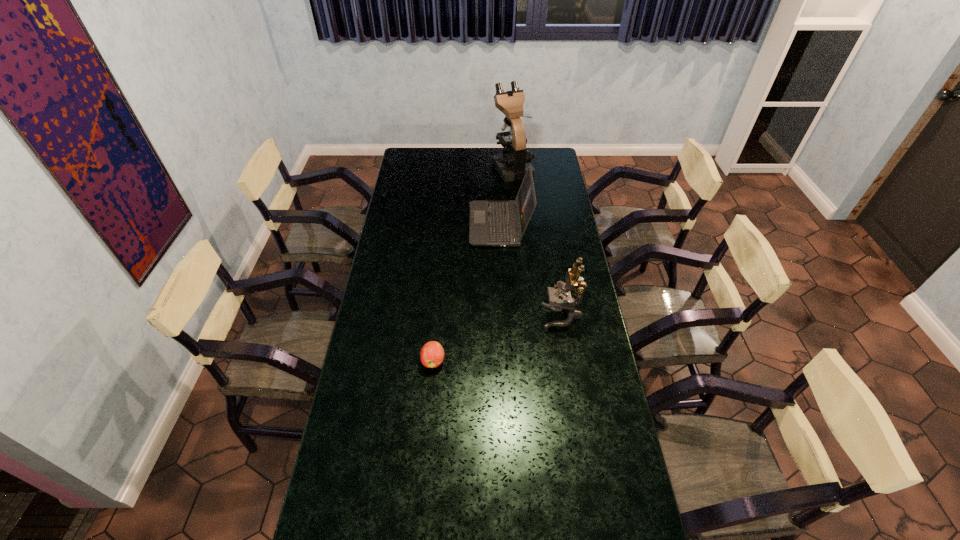
I want to click on empty space that is in between the third tallest object and the shorter microscope, so (531, 271).

The width and height of the screenshot is (960, 540). I want to click on free space between the third shortest object and the farther microscope, so click(x=538, y=241).

Where is `vacant space in between the laptop_computer and the tallest object`? vacant space in between the laptop_computer and the tallest object is located at coordinates (506, 195).

The height and width of the screenshot is (540, 960). Find the location of `vacant point located between the third farthest object and the third tallest object`. vacant point located between the third farthest object and the third tallest object is located at coordinates (531, 271).

Identify the location of free space between the second farthest object and the second tallest object. (531, 271).

This screenshot has width=960, height=540. Find the location of `free area in between the apple and the third nearest object`. free area in between the apple and the third nearest object is located at coordinates point(467,293).

Locate an element on the screen. This screenshot has height=540, width=960. free area in between the nearest object and the second shortest object is located at coordinates (467, 293).

Identify the location of free space that is in between the shortest object and the nearer microscope. This screenshot has width=960, height=540. (497, 339).

Find the location of a particular element. The image size is (960, 540). unoccupied area between the nearer microscope and the leftmost object is located at coordinates (497, 339).

Locate an element on the screen. The image size is (960, 540). unoccupied area between the farther microscope and the second nearest object is located at coordinates (538, 241).